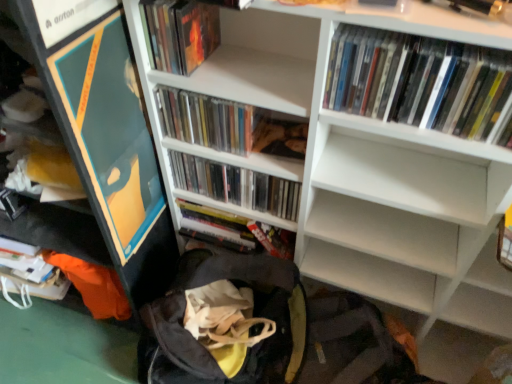
Question: From the image's perspective, does matte plastic books at center, which is counted as the fourth book, starting from the front, appear lower than white matte bookcase at upper center?

Choices:
 (A) no
 (B) yes

Answer: (A)

Question: Are matte plastic books at center, which is counted as the fourth book, starting from the front, and white matte bookcase at upper center far apart?

Choices:
 (A) yes
 (B) no

Answer: (B)

Question: Is matte plastic books at center, marked as the second book in a back-to-front arrangement, to the right of white matte bookcase at upper center from the viewer's perspective?

Choices:
 (A) yes
 (B) no

Answer: (B)

Question: Is matte plastic books at center, marked as the second book in a back-to-front arrangement, oriented towards white matte bookcase at upper center?

Choices:
 (A) yes
 (B) no

Answer: (A)

Question: Considering the relative positions of matte plastic books at center, marked as the second book in a back-to-front arrangement, and white matte bookcase at upper center in the image provided, is matte plastic books at center, marked as the second book in a back-to-front arrangement, to the left of white matte bookcase at upper center from the viewer's perspective?

Choices:
 (A) yes
 (B) no

Answer: (A)

Question: Can you confirm if matte plastic books at center, marked as the second book in a back-to-front arrangement, is wider than white matte bookcase at upper center?

Choices:
 (A) no
 (B) yes

Answer: (A)

Question: From the image's perspective, is white glossy dvds at upper right, the first book from the front, located above silver metallic book at center, which is the first book in back-to-front order?

Choices:
 (A) no
 (B) yes

Answer: (B)

Question: From the image's perspective, does white glossy dvds at upper right, placed as the fifth book when sorted from back to front, appear lower than silver metallic book at center, which is the 5th book in front-to-back order?

Choices:
 (A) no
 (B) yes

Answer: (A)

Question: Is silver metallic book at center, which is the first book in back-to-front order, completely or partially inside white glossy dvds at upper right, the first book from the front?

Choices:
 (A) no
 (B) yes

Answer: (A)

Question: Is white glossy dvds at upper right, the first book from the front, positioned beyond the bounds of silver metallic book at center, which is the first book in back-to-front order?

Choices:
 (A) no
 (B) yes

Answer: (B)

Question: Is white glossy dvds at upper right, the first book from the front, bigger than silver metallic book at center, which is the first book in back-to-front order?

Choices:
 (A) no
 (B) yes

Answer: (B)

Question: Considering the relative sizes of white glossy dvds at upper right, the first book from the front, and silver metallic book at center, which is the 5th book in front-to-back order, in the image provided, is white glossy dvds at upper right, the first book from the front, wider than silver metallic book at center, which is the 5th book in front-to-back order,?

Choices:
 (A) yes
 (B) no

Answer: (B)

Question: Is clear plastic cds at center, the third book from the back, aimed at white glossy dvds at upper right, the first book from the front?

Choices:
 (A) no
 (B) yes

Answer: (A)